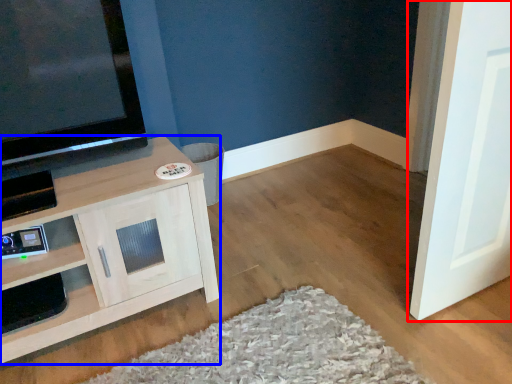
Question: Which object is further to the camera taking this photo, door (highlighted by a red box) or cabinetry (highlighted by a blue box)?

Choices:
 (A) door
 (B) cabinetry

Answer: (B)